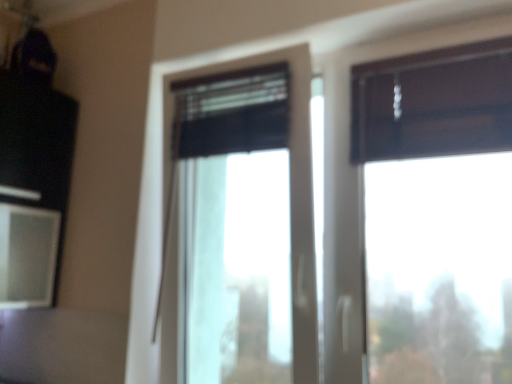
Question: From the image's perspective, is matte white screen at left located beneath dark wood window at upper right, which is counted as the 2th window, starting from the left?

Choices:
 (A) no
 (B) yes

Answer: (B)

Question: Is dark wood window at upper right, which appears as the first window when viewed from the right, at the back of matte white screen at left?

Choices:
 (A) no
 (B) yes

Answer: (A)

Question: Considering the relative positions of matte white screen at left and dark wood window at upper right, which appears as the first window when viewed from the right, in the image provided, is matte white screen at left to the right of dark wood window at upper right, which appears as the first window when viewed from the right, from the viewer's perspective?

Choices:
 (A) no
 (B) yes

Answer: (A)

Question: Considering the relative positions of matte white screen at left and dark wood window at upper right, which is counted as the 2th window, starting from the left, in the image provided, is matte white screen at left to the left of dark wood window at upper right, which is counted as the 2th window, starting from the left, from the viewer's perspective?

Choices:
 (A) no
 (B) yes

Answer: (B)

Question: Considering the relative sizes of matte white screen at left and dark wood window at upper right, which is counted as the 2th window, starting from the left, in the image provided, is matte white screen at left wider than dark wood window at upper right, which is counted as the 2th window, starting from the left,?

Choices:
 (A) yes
 (B) no

Answer: (A)

Question: From a real-world perspective, is matte white screen at left physically above dark wood window at upper right, which is counted as the 2th window, starting from the left?

Choices:
 (A) no
 (B) yes

Answer: (A)

Question: Is black matte window at center, arranged as the 2th window when viewed from the right, with matte white screen at left?

Choices:
 (A) no
 (B) yes

Answer: (A)

Question: Does black matte window at center, which appears as the first window when viewed from the left, appear on the right side of matte white screen at left?

Choices:
 (A) no
 (B) yes

Answer: (B)

Question: Is black matte window at center, which appears as the first window when viewed from the left, not within matte white screen at left?

Choices:
 (A) yes
 (B) no

Answer: (A)

Question: Does black matte window at center, which appears as the first window when viewed from the left, have a greater height compared to matte white screen at left?

Choices:
 (A) yes
 (B) no

Answer: (A)

Question: Does black matte window at center, which appears as the first window when viewed from the left, have a larger size compared to matte white screen at left?

Choices:
 (A) yes
 (B) no

Answer: (A)

Question: Can you confirm if black matte window at center, which appears as the first window when viewed from the left, is shorter than matte white screen at left?

Choices:
 (A) no
 (B) yes

Answer: (A)

Question: From the image's perspective, is dark wood window at upper right, which appears as the first window when viewed from the right, located beneath black matte window at center, arranged as the 2th window when viewed from the right?

Choices:
 (A) yes
 (B) no

Answer: (B)